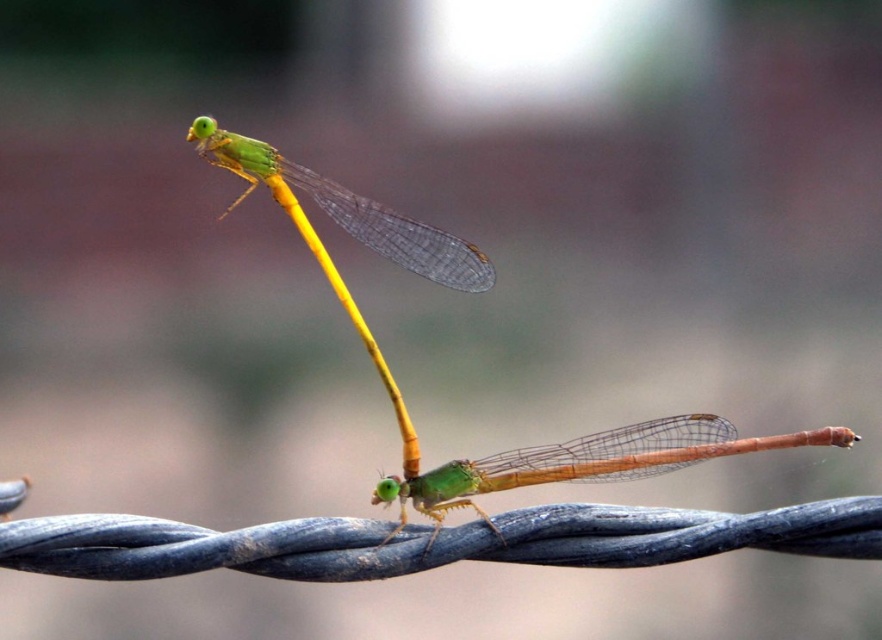
You are an entomologist examining a closeup of two dragonflies on a wire. You notice the green translucent wings at upper left and the translucent yellow stem at center. Which object would cast a bigger shadow if the light source is directly above them?

The green translucent wings at upper left is larger in size than the translucent yellow stem at center, so it would cast a bigger shadow.

You are an entomologist observing dragonflies. You notice the metallic wire at center and the green translucent wings at center. Which object is shorter in height?

The metallic wire at center is shorter in height than the green translucent wings at center.

You are looking at the two dragonflies on the wire. Which dragonfly is closer to you, the one at point (19, 563) or the one at point (537, 481)?

The dragonfly at point (19, 563) is closer to you because point (19, 563) is closer to the viewer than point (537, 481).